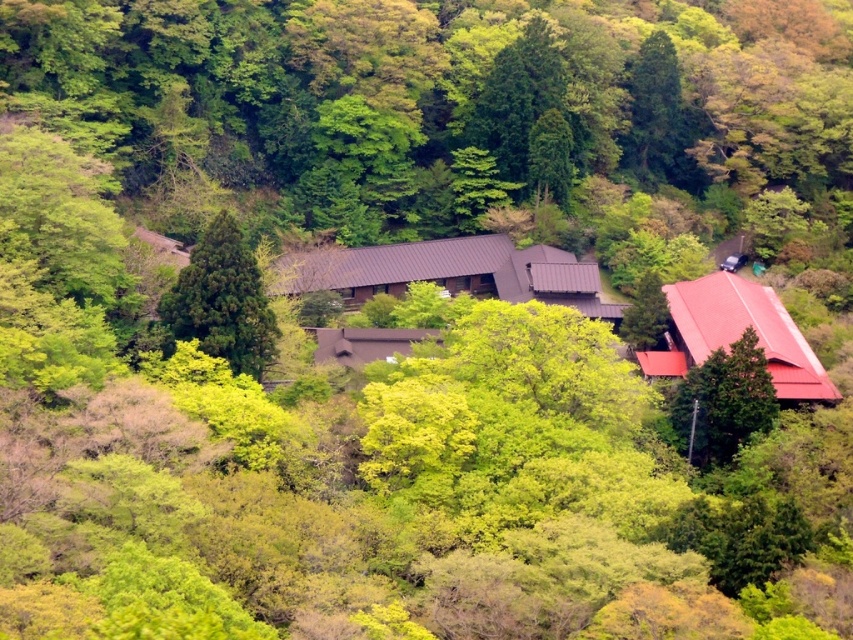
Question: In this image, where is brown corrugated metal hut at center located relative to green leafy tree at center?

Choices:
 (A) above
 (B) below

Answer: (A)

Question: Which point is closer to the camera?

Choices:
 (A) green leafy tree at upper center
 (B) red metal roof at right
 (C) green matte tree at right
 (D) brown corrugated metal hut at center

Answer: (C)

Question: Is brown corrugated metal hut at center to the right of green matte tree at right from the viewer's perspective?

Choices:
 (A) no
 (B) yes

Answer: (A)

Question: Which object is positioned closest to the green matte tree at right?

Choices:
 (A) red metal roof at right
 (B) brown corrugated metal hut at center

Answer: (A)

Question: Does red metal roof at right appear on the left side of green matte tree at right?

Choices:
 (A) yes
 (B) no

Answer: (B)

Question: Which point appears farthest from the camera in this image?

Choices:
 (A) (463, 256)
 (B) (546, 113)
 (C) (218, 337)
 (D) (334, 337)

Answer: (B)